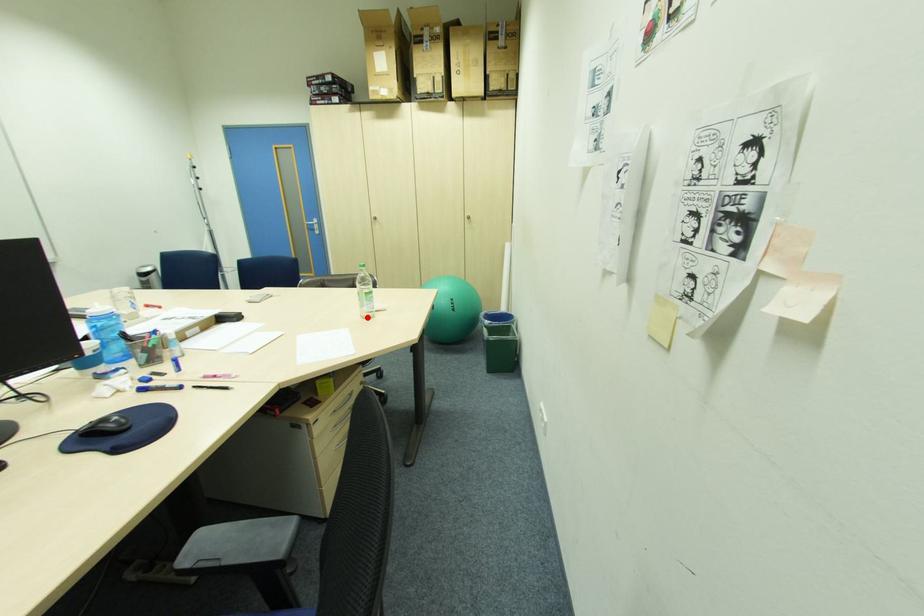
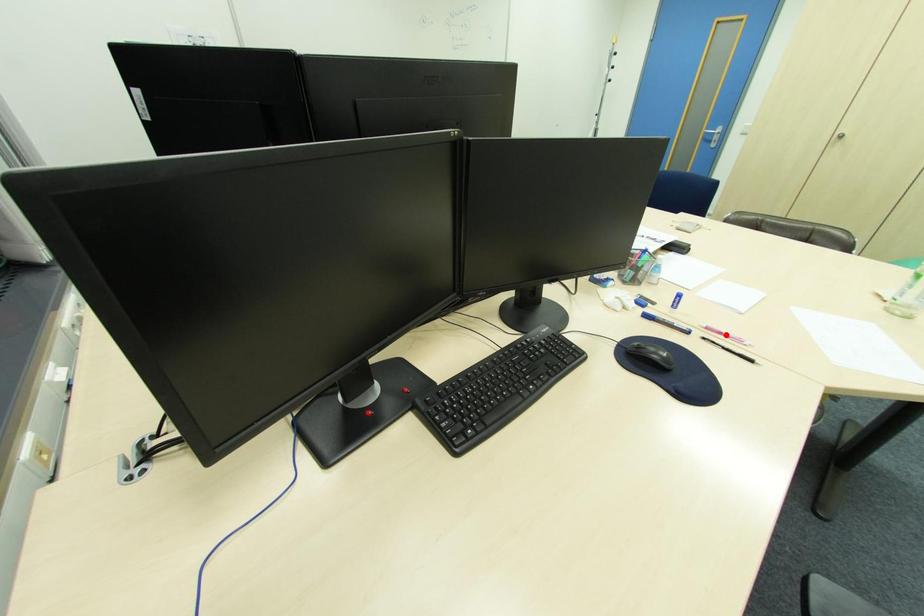
I am providing you with two images of the same scene from different viewpoints. A red point is marked on the first image and another point is marked on the second image. Does the point marked in image1 correspond to the same location as the one in image2?

No